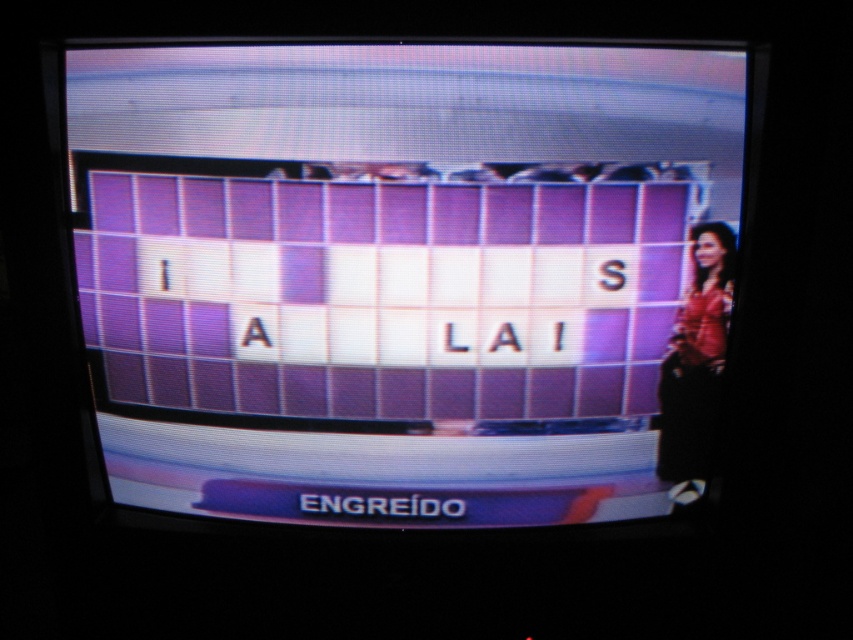
Does purple glossy tiles at center have a larger size compared to matte pink dress at right?

Indeed, purple glossy tiles at center has a larger size compared to matte pink dress at right.

Looking at this image, who is taller, purple glossy tiles at center or matte pink dress at right?

Standing taller between the two is purple glossy tiles at center.

Describe the element at coordinates (399, 273) in the screenshot. I see `purple glossy tiles at center` at that location.

Image resolution: width=853 pixels, height=640 pixels. In order to click on purple glossy tiles at center in this screenshot , I will do `click(399, 273)`.